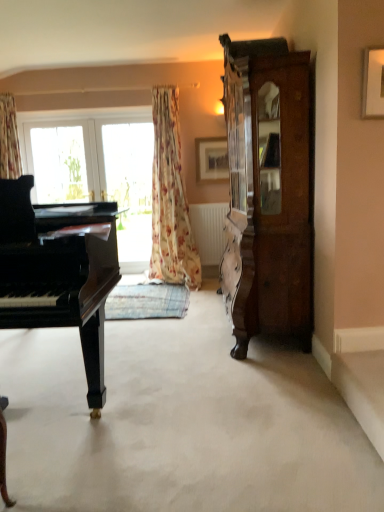
Image resolution: width=384 pixels, height=512 pixels. I want to click on vacant area that lies to the right of black polished piano at left, so click(191, 378).